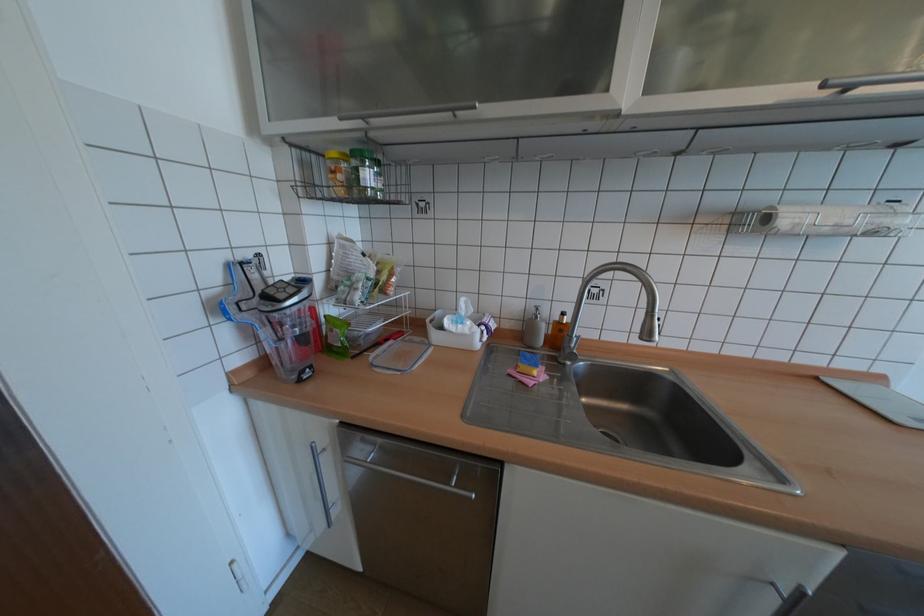
Where is `paper towel roll`? paper towel roll is located at coordinates (835, 220).